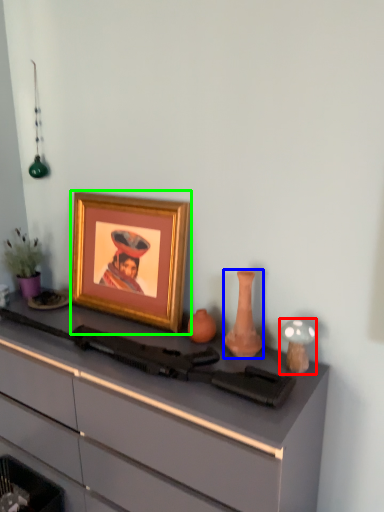
Question: Based on their relative distances, which object is nearer to candle holder (highlighted by a red box)? Choose from vase (highlighted by a blue box) and picture frame (highlighted by a green box).

Choices:
 (A) vase
 (B) picture frame

Answer: (A)